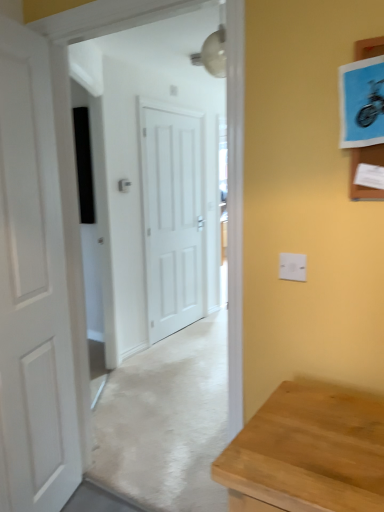
Question: From a real-world perspective, relative to white plastic electric outlet at upper right, is white matte door at center, which appears as the second door when viewed from the left, vertically above or below?

Choices:
 (A) below
 (B) above

Answer: (A)

Question: Is white matte door at center, which ranks as the first door in back-to-front order, bigger or smaller than white plastic electric outlet at upper right?

Choices:
 (A) big
 (B) small

Answer: (A)

Question: Based on their relative distances, which object is nearer to the white matte door at left, the 1th door from the front?

Choices:
 (A) white plastic electric outlet at upper right
 (B) white matte door at center, which ranks as the first door in back-to-front order

Answer: (A)

Question: Which object is positioned farthest from the white matte door at center, which appears as the second door when viewed from the left?

Choices:
 (A) white plastic electric outlet at upper right
 (B) white matte door at left, the second door positioned from the back

Answer: (A)